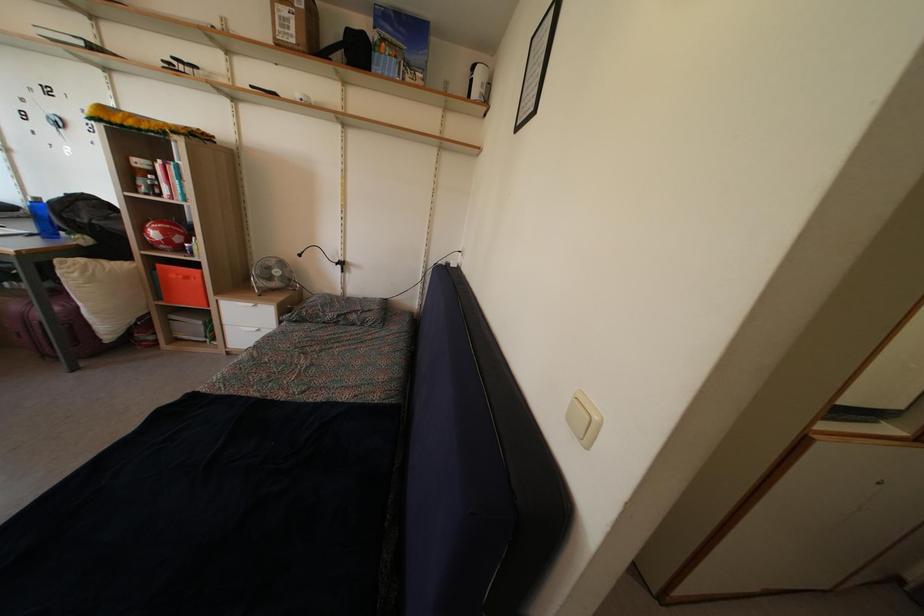
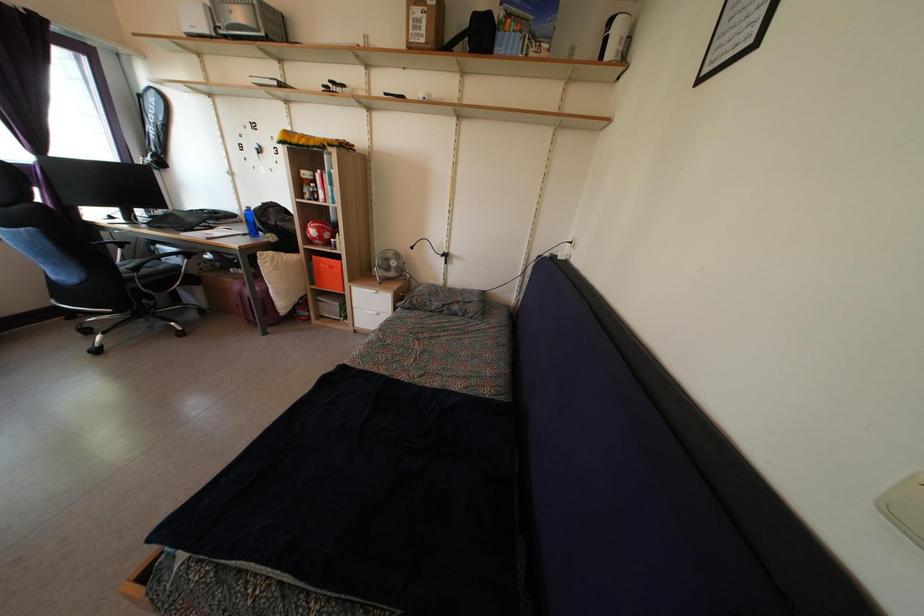
Question: The images are taken continuously from a first-person perspective. In which direction are you moving?

Choices:
 (A) Left
 (B) Right
 (C) Forward
 (D) Backward

Answer: (A)